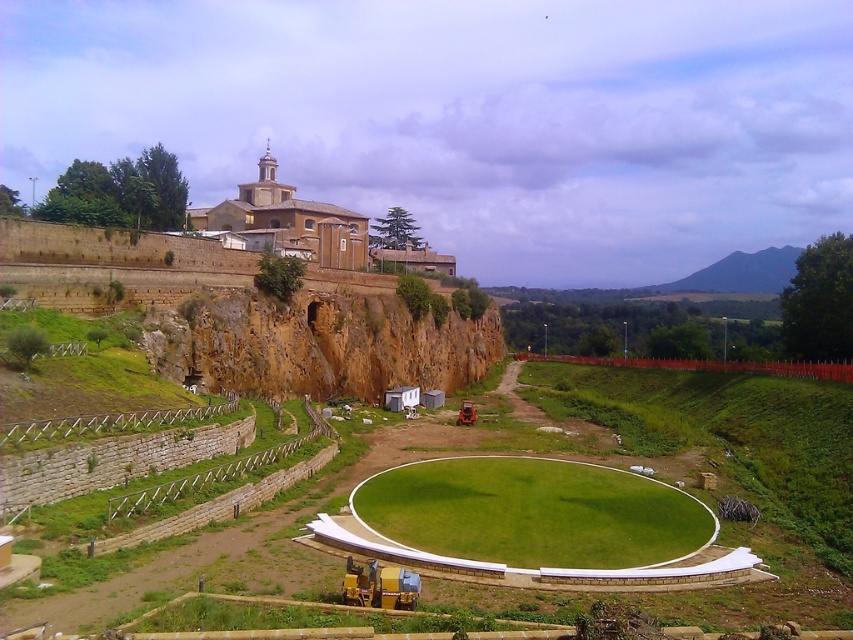
You are standing at the base of the brown stone cliff at upper center and want to reach the smooth stone amphitheater at upper center. Which direction should you walk to get there?

Since the brown stone cliff at upper center is closer to the viewer than the smooth stone amphitheater at upper center, you should walk away from the cliff towards the amphitheater to reach it.

You are planning to build a small garden on the brown stone cliff at upper center and the smooth stone amphitheater at upper center. Which location would be more suitable if you want the garden to be visible from the ground level below?

The brown stone cliff at upper center is not as tall as the smooth stone amphitheater at upper center, so the garden on the brown stone cliff at upper center would be more visible from the ground level below because it is lower in height compared to the amphitheater.

You are planning to host an outdoor event and need to decide between the brown stone cliff at upper center and the smooth stone amphitheater at upper center as the main stage location. Based on their widths, which area can accommodate a wider stage setup?

The brown stone cliff at upper center might be wider than smooth stone amphitheater at upper center, so it can accommodate a wider stage setup.